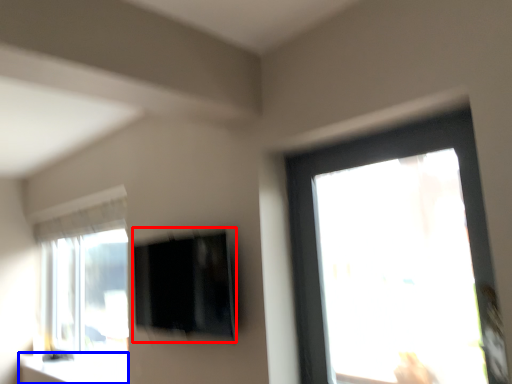
Question: Which of the following is the closest to the observer, window screen (highlighted by a red box) or window sill (highlighted by a blue box)?

Choices:
 (A) window screen
 (B) window sill

Answer: (A)